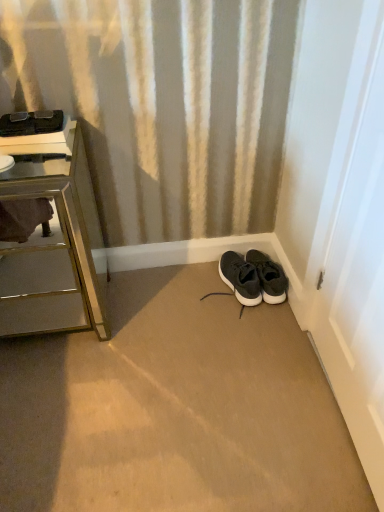
Where is `free region on the left part of white glossy door at right`? Image resolution: width=384 pixels, height=512 pixels. free region on the left part of white glossy door at right is located at coordinates (233, 394).